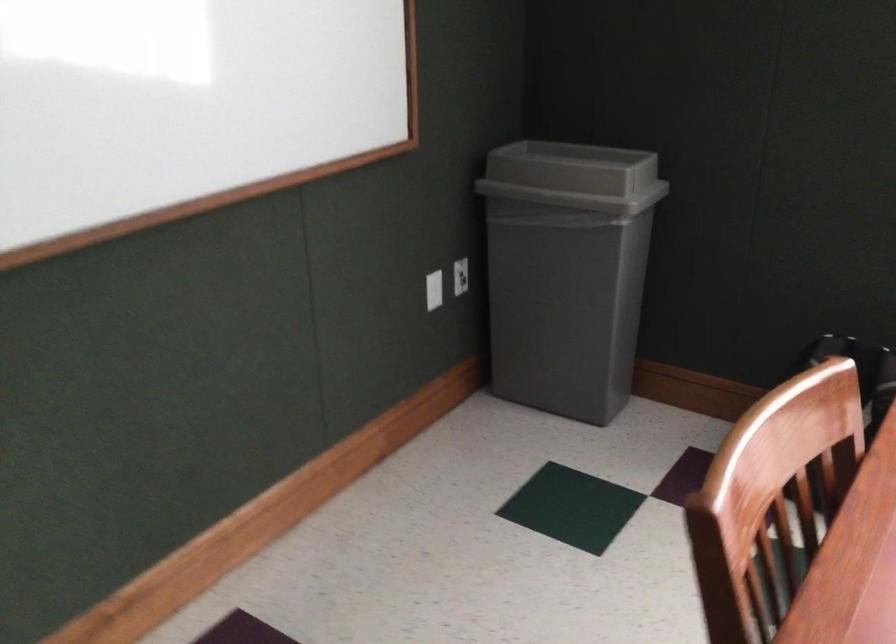
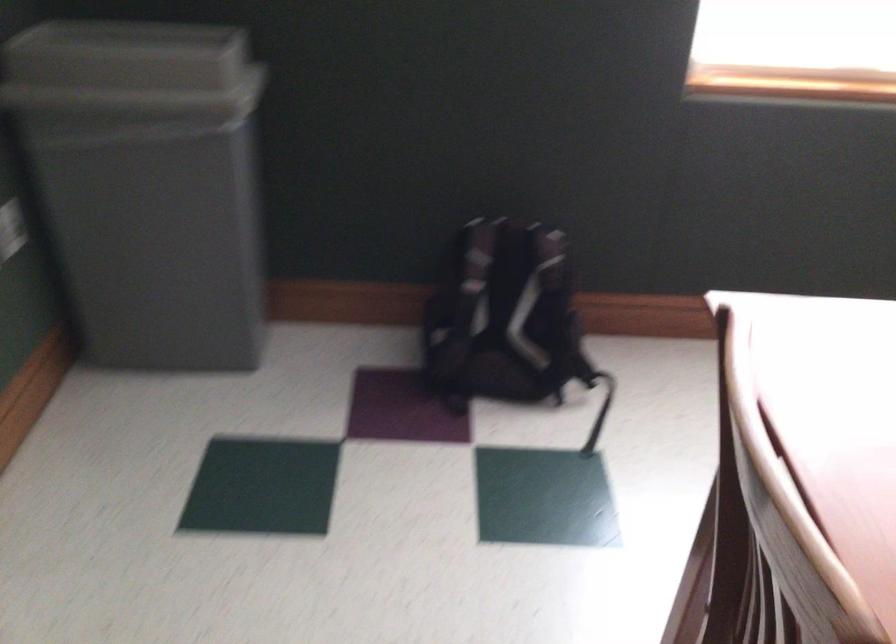
Where in the second image is the point corresponding to [552,176] from the first image?

(131, 71)